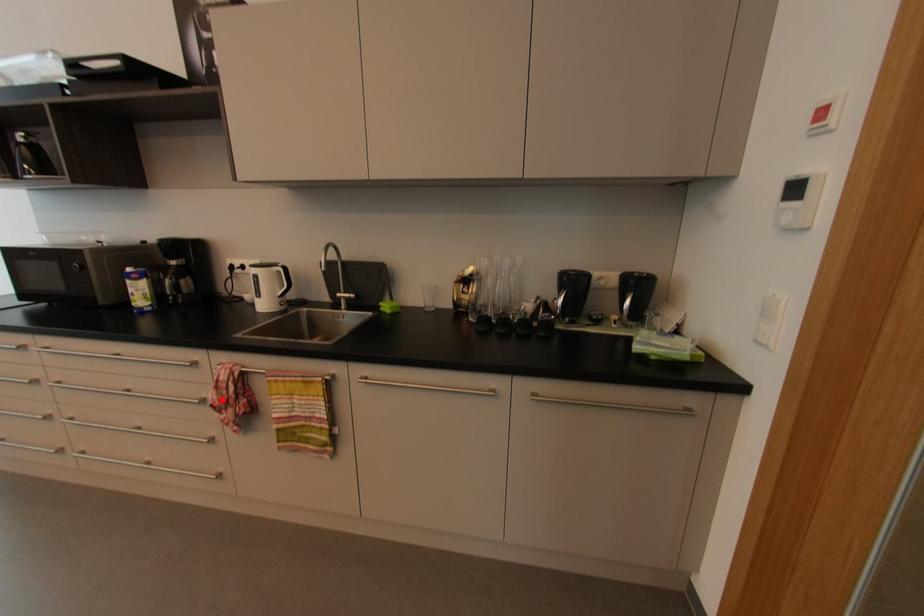
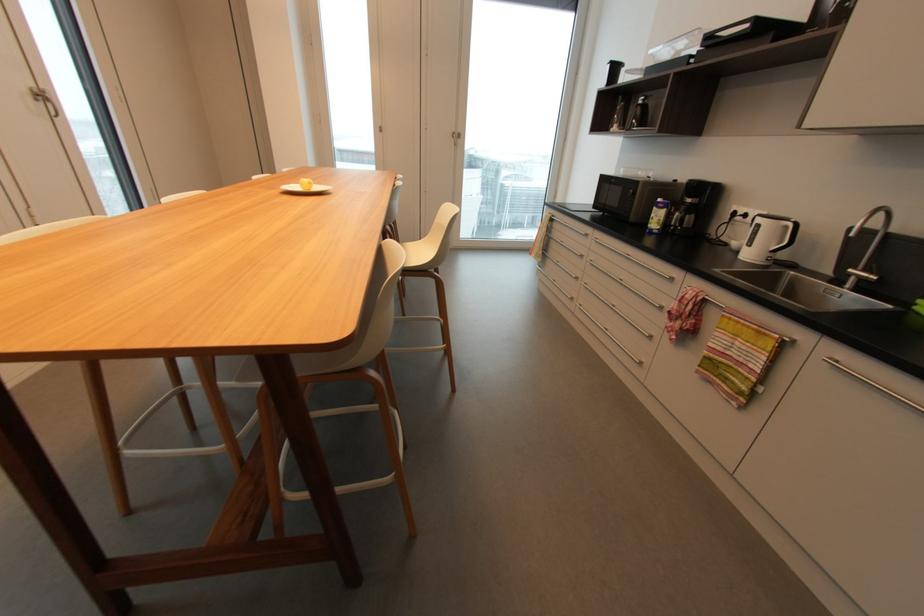
Locate, in the second image, the point that corresponds to the highlighted location in the first image.

(681, 310)